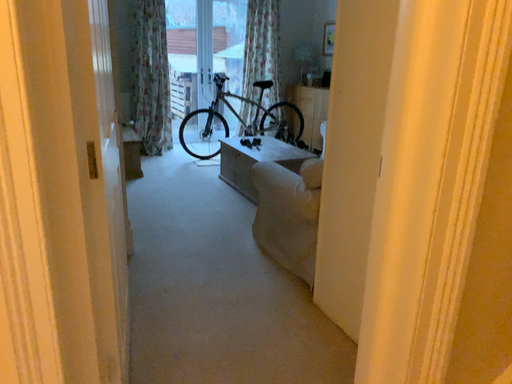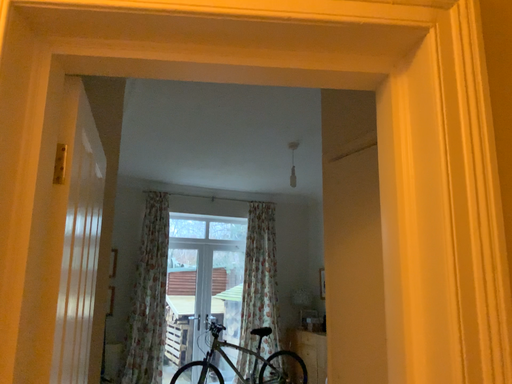
Question: Which way did the camera rotate in the video?

Choices:
 (A) rotated upward
 (B) rotated downward

Answer: (A)